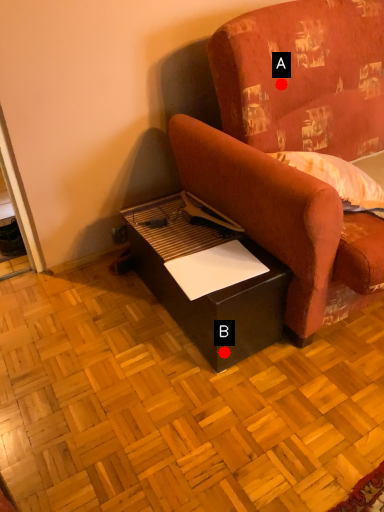
Question: Two points are circled on the image, labeled by A and B beside each circle. Which point is closer to the camera?

Choices:
 (A) A is closer
 (B) B is closer

Answer: (B)